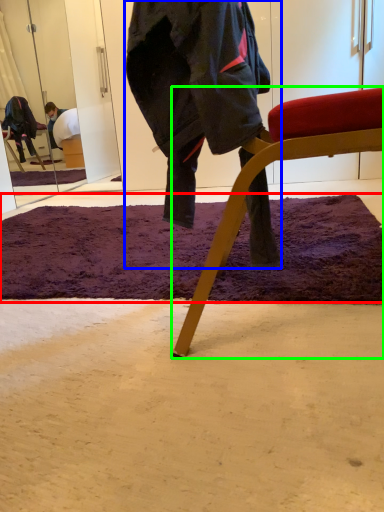
Question: Which is farther away from mat (highlighted by a red box)? person (highlighted by a blue box) or chair (highlighted by a green box)?

Choices:
 (A) person
 (B) chair

Answer: (A)